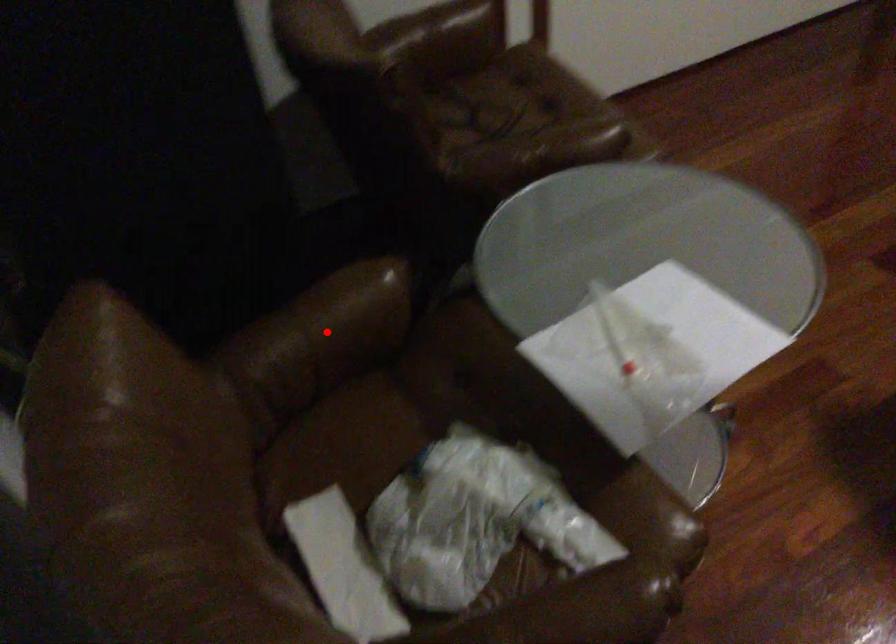
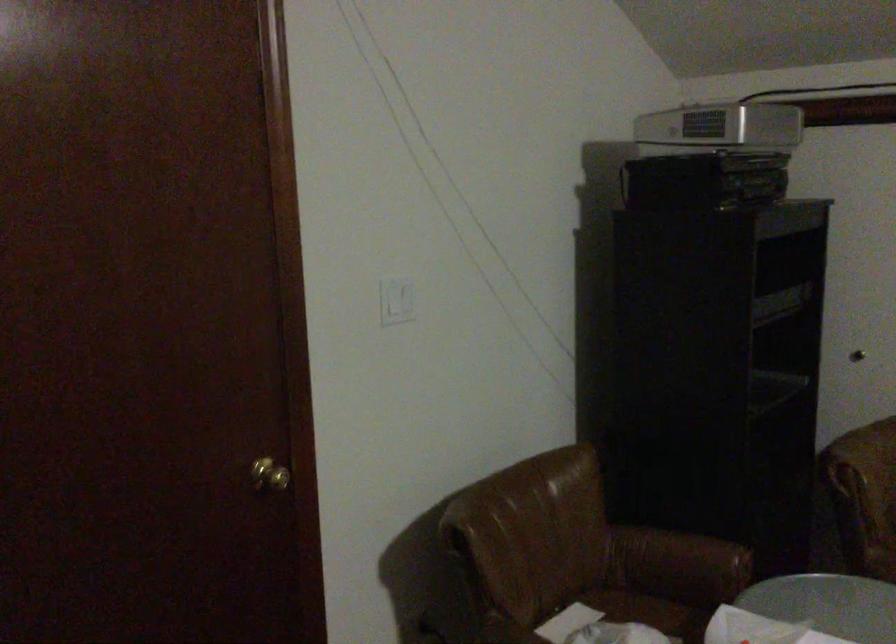
Question: I am providing you with two images of the same scene from different viewpoints. A red point is marked on the first image. Is the red point's position out of view in image 2?

Choices:
 (A) Yes
 (B) No

Answer: (B)